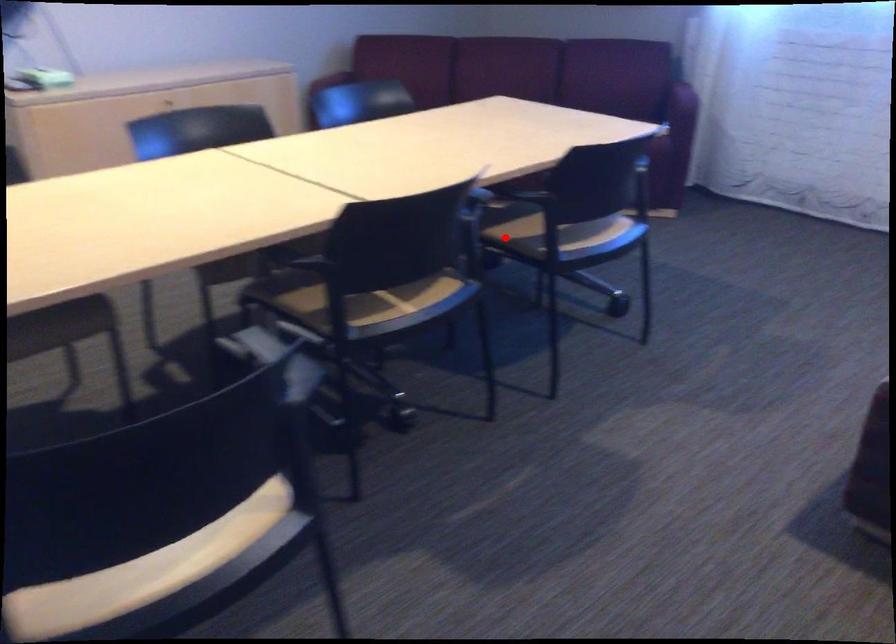
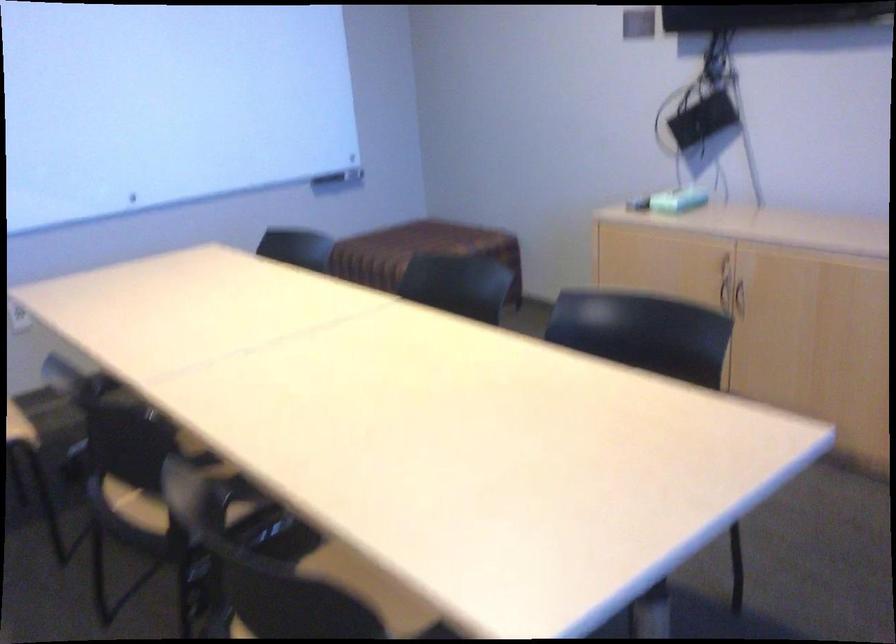
Question: I am providing you with two images of the same scene from different viewpoints. In image1, a red point is highlighted. Considering the same 3D point in image2, which of the following is correct?

Choices:
 (A) It is closer
 (B) It is farther

Answer: (A)